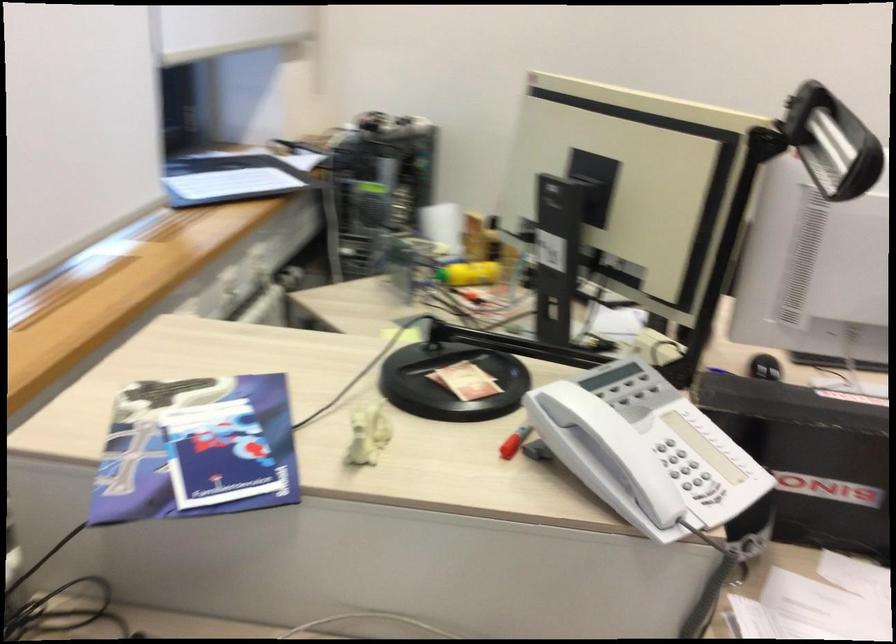
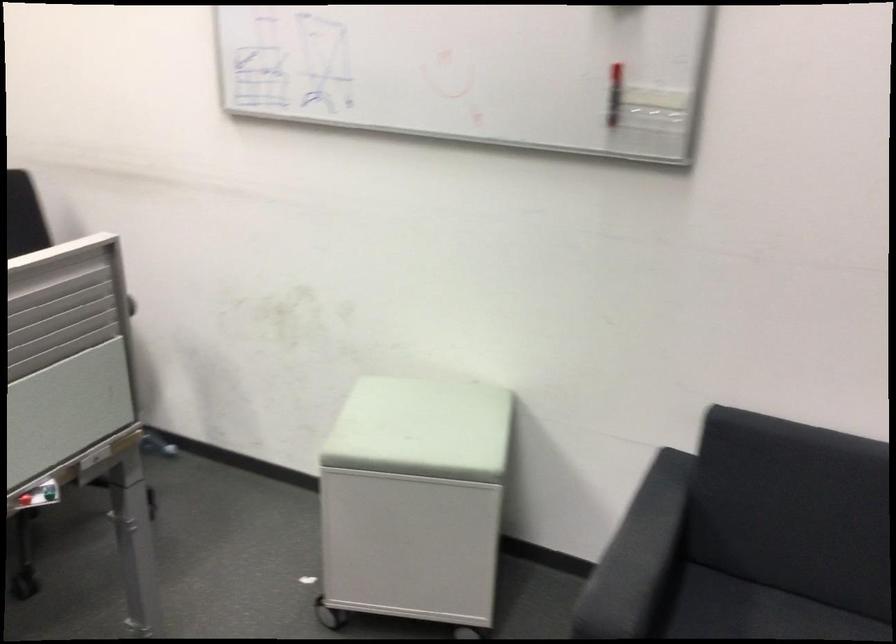
Question: The images are taken continuously from a first-person perspective. In which direction are you moving?

Choices:
 (A) Left
 (B) Right
 (C) Forward
 (D) Backward

Answer: (B)